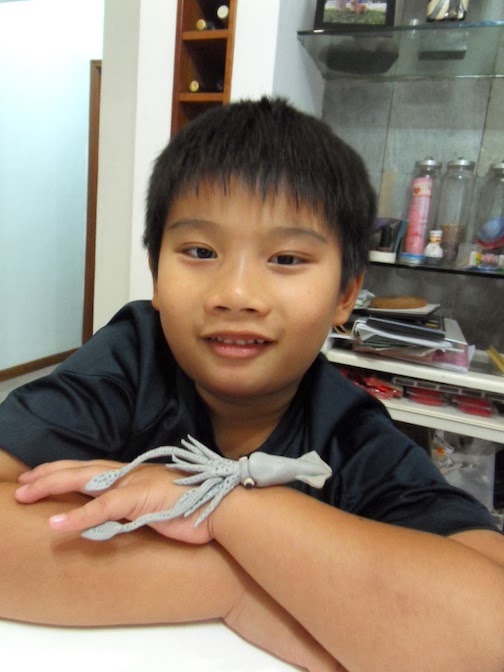
I want to click on brown molding, upper left side, so click(101, 78), click(38, 373).